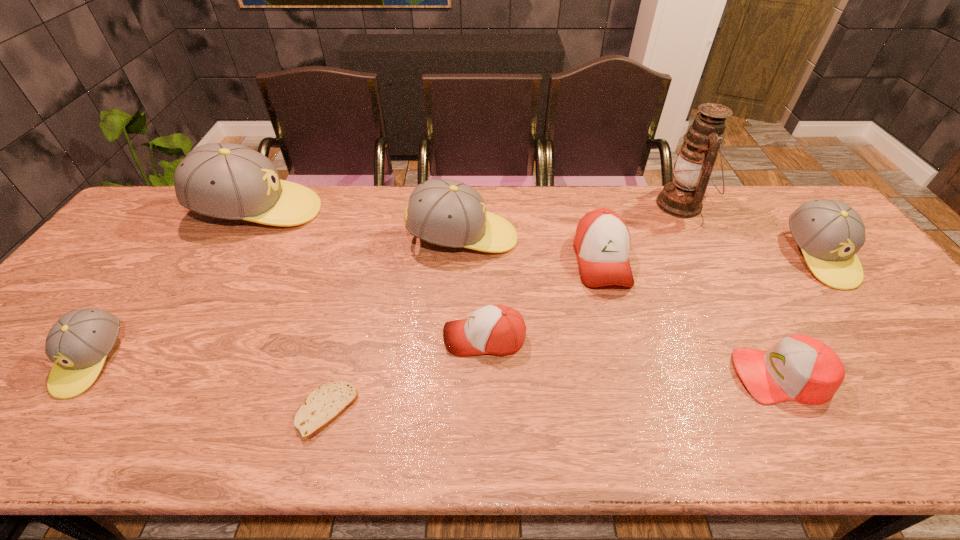
This screenshot has height=540, width=960. I want to click on object situated at the left edge, so click(78, 343).

At what (x,y) coordinates should I click in order to perform the action: click on object located in the right edge section of the desktop. Please return your answer as a coordinate pair (x, y). Image resolution: width=960 pixels, height=540 pixels. Looking at the image, I should click on (829, 232).

This screenshot has width=960, height=540. Identify the location of object that is at the far right corner. (829, 232).

Identify the location of blank area at the far edge. The width and height of the screenshot is (960, 540). (756, 211).

This screenshot has width=960, height=540. In the image, there is a desktop. What are the coordinates of `vacant space at the near edge` in the screenshot? It's located at (491, 445).

Locate an element on the screen. vacant area at the left edge of the desktop is located at coordinates (27, 395).

You are a GUI agent. You are given a task and a screenshot of the screen. Output one action in this format:
    pyautogui.click(x=<x>, y=<y>)
    Task: Click on the vacant space at the right edge of the desktop
    The width and height of the screenshot is (960, 540).
    Given the screenshot: What is the action you would take?
    pyautogui.click(x=889, y=330)

Find the location of `free space between the third smallest yellow baseball cap and the nearer orange baseball cap`. free space between the third smallest yellow baseball cap and the nearer orange baseball cap is located at coordinates (473, 288).

Identify the location of vacant space that is in between the red baseball cap and the bigger orange baseball cap. This screenshot has width=960, height=540. (691, 318).

Locate an element on the screen. free space between the shortest object and the second yellow baseball cap from right to left is located at coordinates (395, 325).